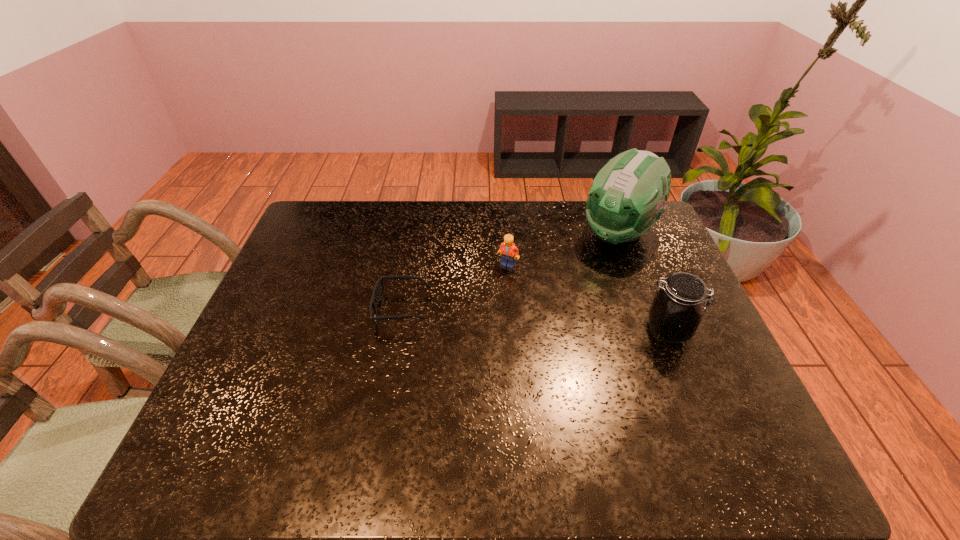
You are a GUI agent. You are given a task and a screenshot of the screen. Output one action in this format:
    pyautogui.click(x=<x>, y=<y>)
    Task: Click on the blank space located on the front-facing side of the Lego
    This screenshot has height=540, width=960.
    Given the screenshot: What is the action you would take?
    pyautogui.click(x=505, y=291)

I want to click on vacant space located 0.250m on the front-facing side of the Lego, so click(500, 334).

Locate an element on the screen. vacant space located on the visor of the tallest object is located at coordinates (563, 291).

Locate an element on the screen. The image size is (960, 540). vacant region located 0.300m on the visor of the tallest object is located at coordinates (544, 308).

Image resolution: width=960 pixels, height=540 pixels. In order to click on vacant area located on the visor of the tallest object in this screenshot , I will do `click(579, 274)`.

I want to click on object that is at the far edge, so click(627, 197).

This screenshot has height=540, width=960. In order to click on jar situated at the right edge in this screenshot , I will do `click(675, 313)`.

The width and height of the screenshot is (960, 540). Identify the location of football helmet present at the right edge. (627, 197).

What are the coordinates of `object present at the far right corner` in the screenshot? It's located at (627, 197).

At what (x,y) coordinates should I click in order to perform the action: click on vacant space at the far edge. Please return your answer as a coordinate pair (x, y). Image resolution: width=960 pixels, height=540 pixels. Looking at the image, I should click on (468, 222).